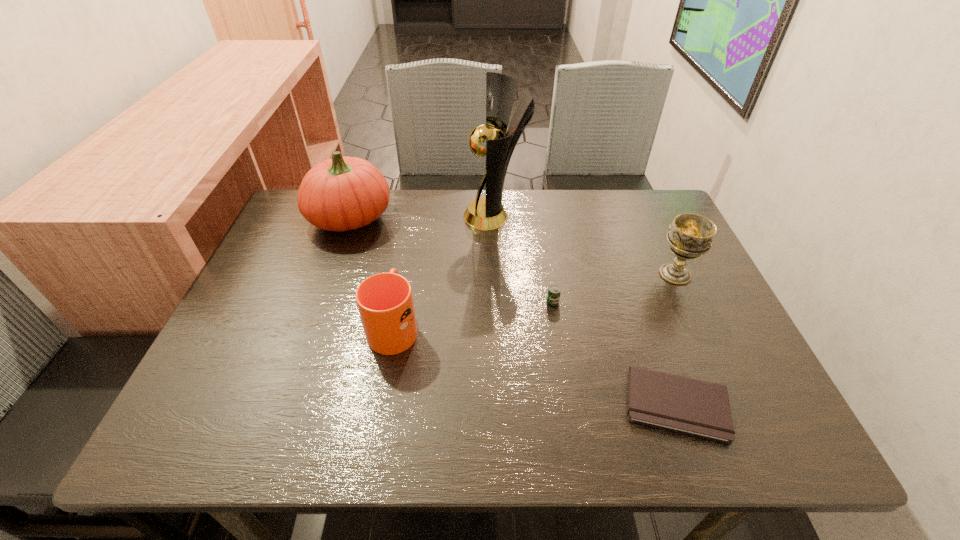
The height and width of the screenshot is (540, 960). Find the location of `vacant region located 0.390m at the front of the tallest object, where the globe is visible`. vacant region located 0.390m at the front of the tallest object, where the globe is visible is located at coordinates (329, 216).

At what (x,y) coordinates should I click in order to perform the action: click on vacant area situated 0.060m on the front of the pumpkin. Please return your answer as a coordinate pair (x, y). Looking at the image, I should click on (335, 260).

The image size is (960, 540). I want to click on free space located 0.230m on the left of the fourth nearest object, so click(564, 274).

Where is `free region located on the handle side of the fifth object from right to left`? free region located on the handle side of the fifth object from right to left is located at coordinates (413, 221).

The image size is (960, 540). Find the location of `vacant area situated on the handle side of the fifth object from right to left`. vacant area situated on the handle side of the fifth object from right to left is located at coordinates (402, 279).

Where is `vacant region located 0.400m on the handle side of the fifth object from right to left`? The height and width of the screenshot is (540, 960). vacant region located 0.400m on the handle side of the fifth object from right to left is located at coordinates [x=417, y=202].

You are a GUI agent. You are given a task and a screenshot of the screen. Output one action in this format:
    pyautogui.click(x=<x>, y=<y>)
    Task: Click on the vacant space situated on the back of the beer can
    The image size is (960, 540).
    Given the screenshot: What is the action you would take?
    pyautogui.click(x=538, y=211)

This screenshot has width=960, height=540. Identify the location of free spot located on the back of the nearest object. (624, 254).

This screenshot has width=960, height=540. What are the coordinates of `award that is at the far edge` in the screenshot? It's located at (487, 213).

Identify the location of pumpkin that is at the far edge. (345, 193).